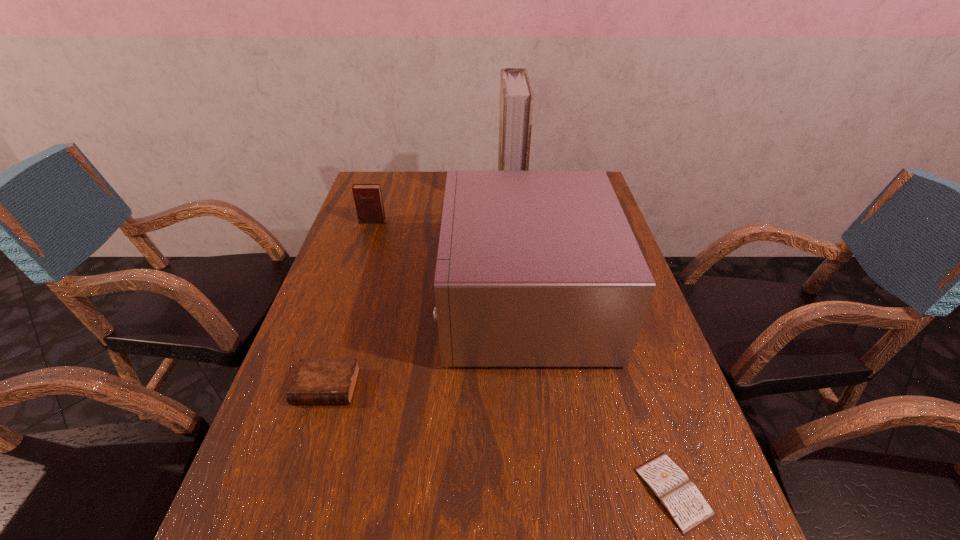
Locate an element on the screen. The width and height of the screenshot is (960, 540). vacant point located between the second tallest diary and the shortest object is located at coordinates (499, 439).

Where is `object that is the second nearest to the tallest diary`? This screenshot has width=960, height=540. object that is the second nearest to the tallest diary is located at coordinates (516, 96).

Find the location of a particular element. The height and width of the screenshot is (540, 960). object that is the fourth closest to the second tallest diary is located at coordinates (516, 96).

Locate an element on the screen. This screenshot has height=540, width=960. the second closest diary to the second shortest diary is located at coordinates click(x=368, y=200).

Identify which diary is the second nearest to the microwave oven. Please provide its 2D coordinates. Your answer should be formatted as a tuple, i.e. [(x, y)], where the tuple contains the x and y coordinates of a point satisfying the conditions above.

[(681, 499)]

Locate an element on the screen. free location that satisfies the following two spatial constraints: 1. on the cover of the phonebook; 2. on the spine side of the fourth tallest object is located at coordinates (530, 387).

This screenshot has width=960, height=540. What are the coordinates of `free spot that satisfies the following two spatial constraints: 1. with the door open on the microwave oven; 2. on the spine side of the second farthest diary` in the screenshot? It's located at (534, 387).

You are a GUI agent. You are given a task and a screenshot of the screen. Output one action in this format:
    pyautogui.click(x=<x>, y=<y>)
    Task: Click on the vacant space that satisfies the following two spatial constraints: 1. on the front cover of the tallest diary; 2. on the left side of the rightmost diary
    
    Given the screenshot: What is the action you would take?
    pyautogui.click(x=283, y=491)

This screenshot has height=540, width=960. I want to click on vacant space that satisfies the following two spatial constraints: 1. on the cover of the farthest object; 2. on the left side of the rightmost diary, so click(x=540, y=491).

Locate an element on the screen. Image resolution: width=960 pixels, height=540 pixels. vacant area that satisfies the following two spatial constraints: 1. on the cover of the farthest object; 2. on the front cover of the farthest diary is located at coordinates (514, 221).